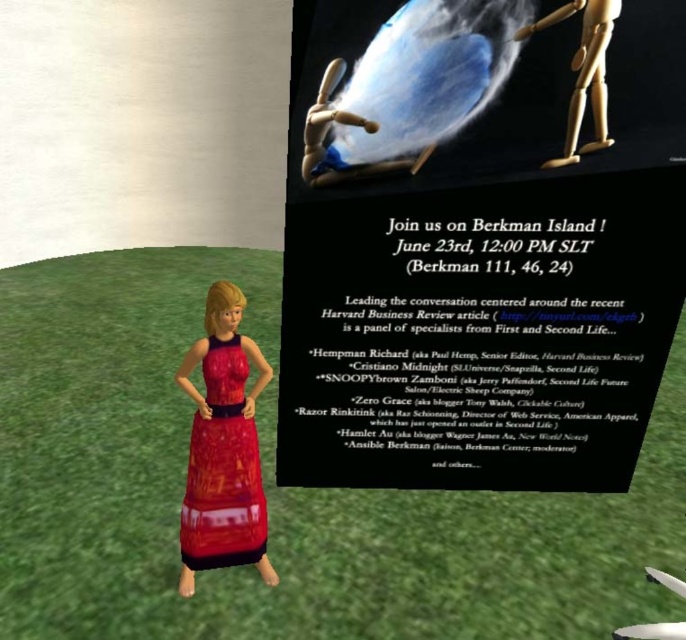
Is shiny red dress at lower left closer to camera compared to wooden puppet at center?

No.

Is shiny red dress at lower left to the right of wooden puppet at center from the viewer's perspective?

Incorrect, shiny red dress at lower left is not on the right side of wooden puppet at center.

Is point (250, 481) closer to camera compared to point (335, 74)?

No, (250, 481) is behind (335, 74).

Locate an element on the screen. shiny red dress at lower left is located at coordinates (222, 468).

Does matte black poster at center have a lesser width compared to wooden puppet at center?

Incorrect, matte black poster at center's width is not less than wooden puppet at center's.

Describe the element at coordinates (480, 243) in the screenshot. The width and height of the screenshot is (686, 640). I see `matte black poster at center` at that location.

Which is behind, point (571, 326) or point (397, 164)?

The point (571, 326) is more distant.

You are a GUI agent. You are given a task and a screenshot of the screen. Output one action in this format:
    pyautogui.click(x=<x>, y=<y>)
    Task: Click on the matte black poster at center
    The width and height of the screenshot is (686, 640).
    Given the screenshot: What is the action you would take?
    pyautogui.click(x=480, y=243)

Does wooden figure at upper right appear under wooden puppet at center?

No.

Does point (606, 124) lie in front of point (359, 125)?

Yes, point (606, 124) is closer to viewer.

Which is in front, point (582, 17) or point (351, 122)?

Positioned in front is point (582, 17).

Locate an element on the screen. The image size is (686, 640). wooden figure at upper right is located at coordinates tap(582, 72).